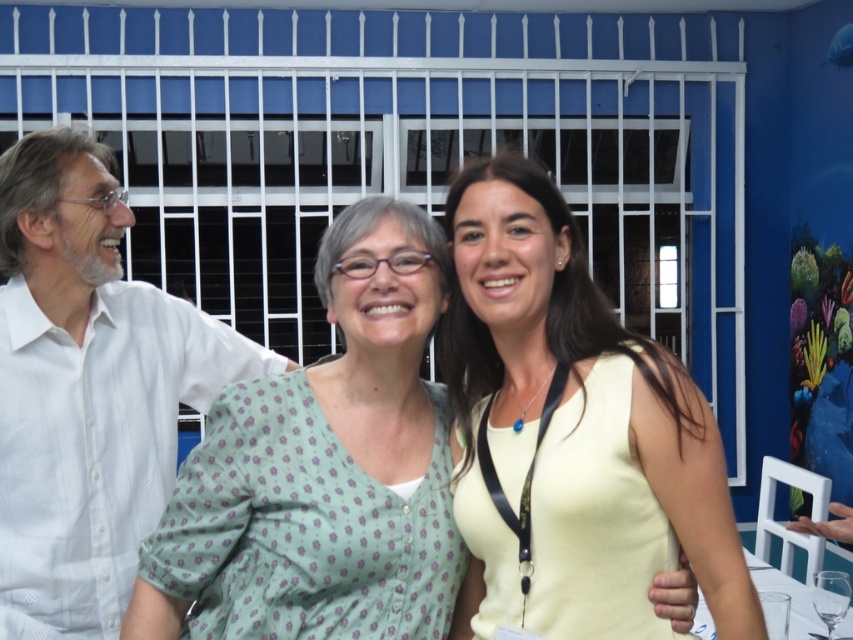
You are organizing a clothing donation drive and need to determine which item takes up more space. Which object between the yellow matte tank top at center and the transparent glass at lower right has a greater width?

The yellow matte tank top at center has a greater width than the transparent glass at lower right according to the description.

You are at a party and want to hand a drink to the person wearing the green floral blouse at center without touching the transparent glass at lower right. Which direction should you approach from?

The green floral blouse at center is positioned on the left side of transparent glass at lower right, so you should approach from the left side to avoid touching the glass.